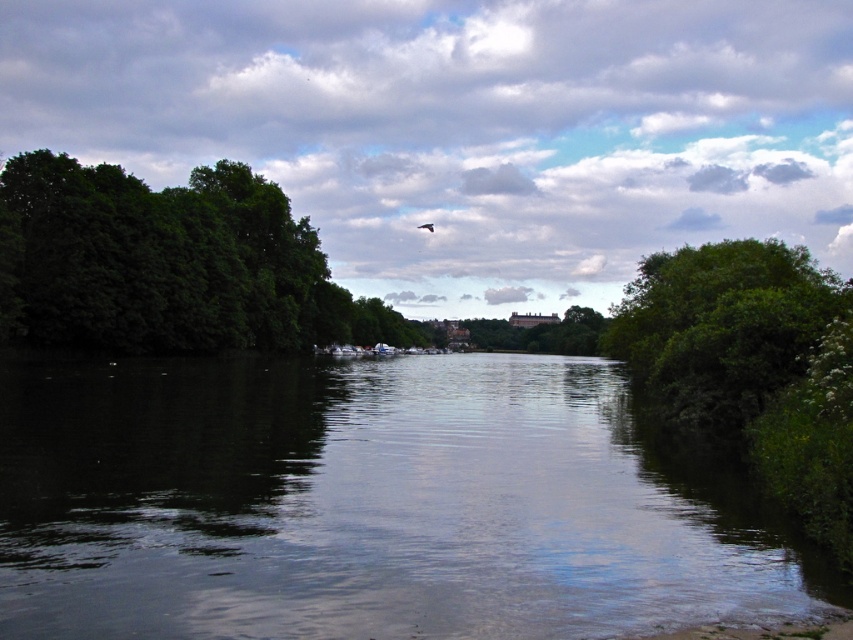
Question: Which point appears closest to the camera in this image?

Choices:
 (A) (619, 397)
 (B) (769, 376)
 (C) (39, 314)

Answer: (B)

Question: Is green leafy tree at right to the left of dark brown feathered bird at center from the viewer's perspective?

Choices:
 (A) yes
 (B) no

Answer: (B)

Question: Which object is farther from the camera taking this photo?

Choices:
 (A) dark brown feathered bird at center
 (B) green leafy trees at left
 (C) green leafy tree at right

Answer: (A)

Question: Which object is positioned closest to the green leafy tree at right?

Choices:
 (A) green leafy trees at left
 (B) dark reflective water at center

Answer: (B)

Question: Is dark reflective water at center smaller than green leafy trees at left?

Choices:
 (A) yes
 (B) no

Answer: (A)

Question: Is green leafy trees at left below dark brown feathered bird at center?

Choices:
 (A) yes
 (B) no

Answer: (A)